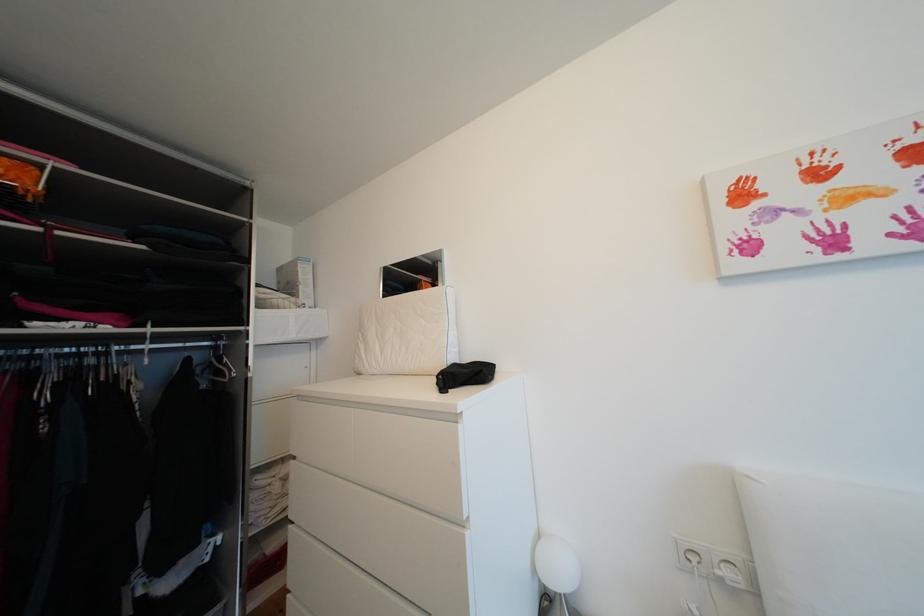
What do you see at coordinates (465, 375) in the screenshot?
I see `a black pouch` at bounding box center [465, 375].